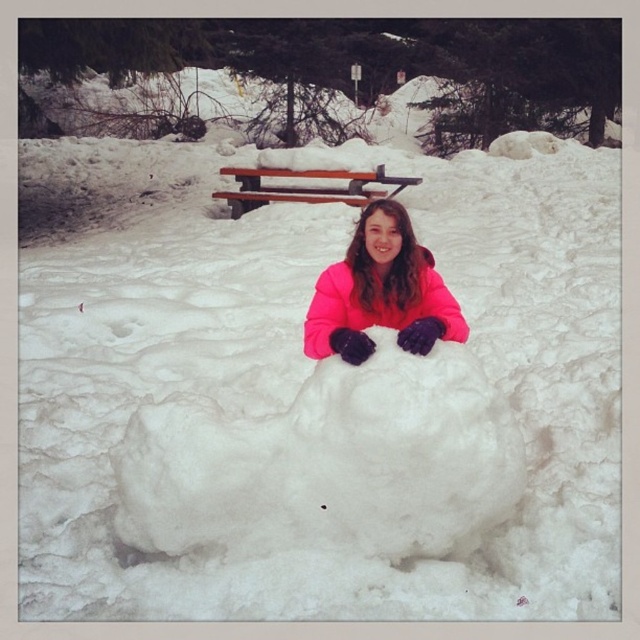
You are trying to locate the pink fleece jacket at center and the brown wooden bench at upper center in the winter scene. Based on their positions, which object is higher up in the image?

The brown wooden bench at upper center is higher up in the image because it is positioned above the pink fleece jacket at center.

You are a photographer trying to capture the person in the bright pink jacket who is partially buried in the snow. You want to place your camera at the point marked as point (330, 464). Will this point be on the person or on the snowball?

The point (330, 464) is on the white fluffy snowball at center, so placing the camera there would position it on the snowball rather than the person.

You are trying to locate the white fluffy snowball at center and the brown wooden bench at upper center in the winter scene. According to the image, which object is positioned to the right side?

The white fluffy snowball at center is to the right of the brown wooden bench at upper center.